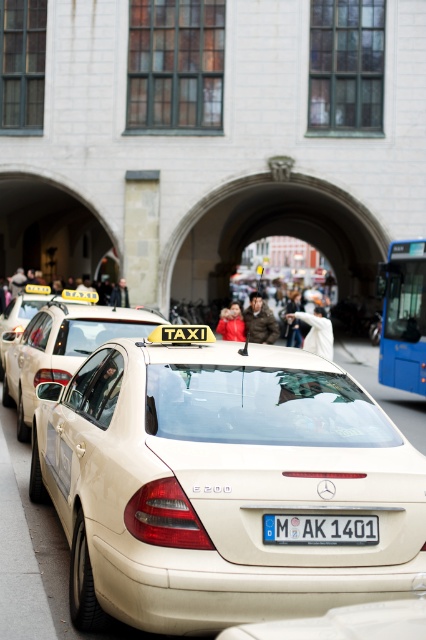
Question: Is blue metallic bus at right to the right of beige matte taxi at center from the viewer's perspective?

Choices:
 (A) yes
 (B) no

Answer: (A)

Question: Does matte beige taxi at center have a greater width compared to blue metallic bus at right?

Choices:
 (A) no
 (B) yes

Answer: (B)

Question: Which point appears closest to the camera in this image?

Choices:
 (A) (52, 362)
 (B) (370, 465)

Answer: (B)

Question: Which of the following is the farthest from the observer?

Choices:
 (A) blue metallic bus at right
 (B) beige matte taxi at center
 (C) metallic beige taxi at center
 (D) matte beige taxi at center

Answer: (A)

Question: Can you confirm if matte beige taxi at center is positioned below blue metallic license plate at center?

Choices:
 (A) yes
 (B) no

Answer: (B)

Question: Which point is farther to the camera?

Choices:
 (A) (265, 518)
 (B) (11, 332)
 (C) (51, 346)
 (D) (213, 486)

Answer: (B)